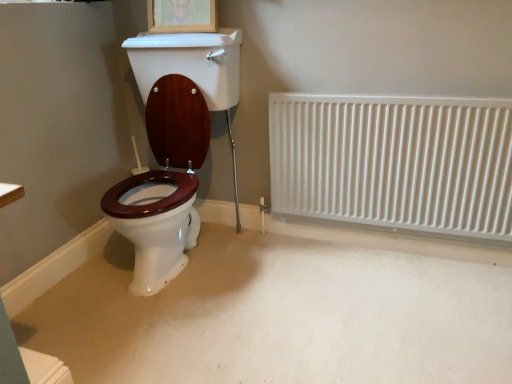
Question: From the image's perspective, is wooden picture frame at upper center positioned above or below white metallic radiator at right?

Choices:
 (A) above
 (B) below

Answer: (A)

Question: Considering the positions of wooden picture frame at upper center and white metallic radiator at right in the image, is wooden picture frame at upper center taller or shorter than white metallic radiator at right?

Choices:
 (A) tall
 (B) short

Answer: (B)

Question: Considering the positions of wooden picture frame at upper center and white metallic radiator at right in the image, is wooden picture frame at upper center wider or thinner than white metallic radiator at right?

Choices:
 (A) thin
 (B) wide

Answer: (B)

Question: Visually, is white metallic radiator at right positioned to the left or to the right of wooden picture frame at upper center?

Choices:
 (A) left
 (B) right

Answer: (B)

Question: Considering the positions of point (336, 122) and point (160, 13), is point (336, 122) closer or farther from the camera than point (160, 13)?

Choices:
 (A) farther
 (B) closer

Answer: (B)

Question: From a real-world perspective, is white metallic radiator at right physically located above or below wooden picture frame at upper center?

Choices:
 (A) below
 (B) above

Answer: (A)

Question: Considering their positions, is white metallic radiator at right located in front of or behind wooden picture frame at upper center?

Choices:
 (A) behind
 (B) front

Answer: (B)